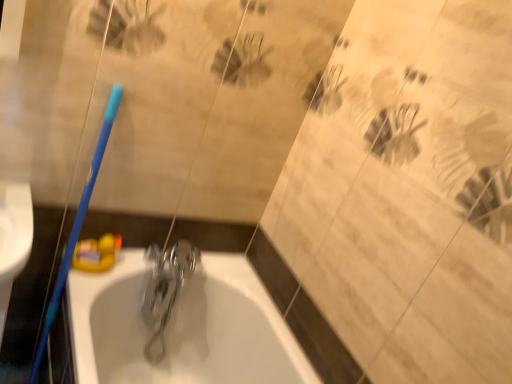
What do you see at coordinates (76, 228) in the screenshot? I see `blue plastic toothbrush at left` at bounding box center [76, 228].

Identify the location of blue plastic toothbrush at left. Image resolution: width=512 pixels, height=384 pixels. (76, 228).

Find the location of a particular element. The height and width of the screenshot is (384, 512). polished metallic faucet at center is located at coordinates (166, 289).

I want to click on blue plastic toothbrush at left, so click(76, 228).

Considering the positions of objects polished metallic faucet at center and blue plastic toothbrush at left in the image provided, who is in front, polished metallic faucet at center or blue plastic toothbrush at left?

blue plastic toothbrush at left is closer to the camera.

From the image's perspective, is polished metallic faucet at center located beneath blue plastic toothbrush at left?

Yes.

Looking at the image, does polished metallic faucet at center seem bigger or smaller compared to blue plastic toothbrush at left?

In the image, polished metallic faucet at center appears to be smaller than blue plastic toothbrush at left.

Is point (309, 383) closer or farther from the camera than point (99, 166)?

Point (309, 383).

From a real-world perspective, is white glossy bathtub at center on top of blue plastic toothbrush at left?

→ Actually, white glossy bathtub at center is physically below blue plastic toothbrush at left in the real world.

In the scene shown: Is white glossy bathtub at center aimed at blue plastic toothbrush at left?

Yes, white glossy bathtub at center is facing blue plastic toothbrush at left.

Is white glossy bathtub at center not close to blue plastic toothbrush at left?

white glossy bathtub at center is near blue plastic toothbrush at left, not far away.

Is white glossy bathtub at center aimed at polished metallic faucet at center?

No, white glossy bathtub at center is not oriented towards polished metallic faucet at center.

Do you think white glossy bathtub at center is within polished metallic faucet at center, or outside of it?

white glossy bathtub at center is spatially situated outside polished metallic faucet at center.

Is white glossy bathtub at center located within blue plastic toothbrush at left?

That's incorrect, white glossy bathtub at center is not inside blue plastic toothbrush at left.

Does blue plastic toothbrush at left turn towards white glossy bathtub at center?

No, blue plastic toothbrush at left is not oriented towards white glossy bathtub at center.

Does point (83, 197) come closer to viewer compared to point (226, 343)?

Yes, it is in front of point (226, 343).

From a real-world perspective, relative to polished metallic faucet at center, is blue plastic toothbrush at left vertically above or below?

Clearly, from a real-world perspective, blue plastic toothbrush at left is above polished metallic faucet at center.

Which object is positioned more to the right, blue plastic toothbrush at left or polished metallic faucet at center?

Positioned to the right is polished metallic faucet at center.

Is blue plastic toothbrush at left directly adjacent to polished metallic faucet at center?

They are not placed beside each other.

Where is `toothbrush above the polished metallic faucet at center (from the image's perspective)`? Image resolution: width=512 pixels, height=384 pixels. toothbrush above the polished metallic faucet at center (from the image's perspective) is located at coordinates (76, 228).

Considering the relative sizes of polished metallic faucet at center and white glossy bathtub at center in the image provided, is polished metallic faucet at center wider than white glossy bathtub at center?

No, polished metallic faucet at center is not wider than white glossy bathtub at center.

Is the surface of polished metallic faucet at center in direct contact with white glossy bathtub at center?

No, polished metallic faucet at center is not touching white glossy bathtub at center.

Which of these two, polished metallic faucet at center or white glossy bathtub at center, is bigger?

With larger size is white glossy bathtub at center.

Where is `tap that appears below the blue plastic toothbrush at left (from a real-world perspective)`? This screenshot has height=384, width=512. tap that appears below the blue plastic toothbrush at left (from a real-world perspective) is located at coordinates (166, 289).

The height and width of the screenshot is (384, 512). I want to click on bathtub on the right of blue plastic toothbrush at left, so click(182, 327).

From the image, which object appears to be nearer to blue plastic toothbrush at left, polished metallic faucet at center or white glossy bathtub at center?

Among the two, polished metallic faucet at center is located nearer to blue plastic toothbrush at left.

Considering their positions, is white glossy bathtub at center positioned closer to polished metallic faucet at center than blue plastic toothbrush at left?

white glossy bathtub at center is positioned closer to the anchor polished metallic faucet at center.

From the image, which object appears to be farther from blue plastic toothbrush at left, white glossy bathtub at center or polished metallic faucet at center?

Among the two, white glossy bathtub at center is located further to blue plastic toothbrush at left.

Based on their spatial positions, is polished metallic faucet at center or blue plastic toothbrush at left further from white glossy bathtub at center?

blue plastic toothbrush at left is further to white glossy bathtub at center.

In the scene shown: Looking at the image, which one is located closer to white glossy bathtub at center, blue plastic toothbrush at left or polished metallic faucet at center?

The object closer to white glossy bathtub at center is polished metallic faucet at center.

Estimate the real-world distances between objects in this image. Which object is closer to polished metallic faucet at center, blue plastic toothbrush at left or white glossy bathtub at center?

white glossy bathtub at center.

The width and height of the screenshot is (512, 384). Identify the location of bathtub between blue plastic toothbrush at left and polished metallic faucet at center in the front-back direction. click(x=182, y=327).